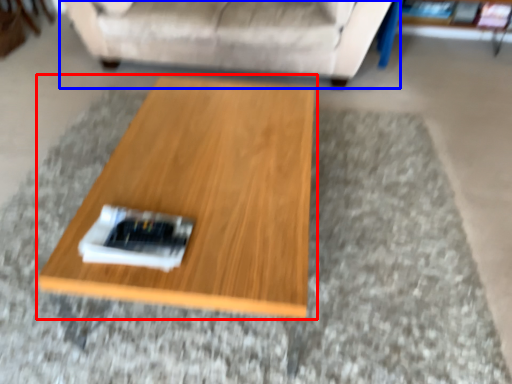
Question: Among these objects, which one is farthest to the camera, coffee table (highlighted by a red box) or studio couch (highlighted by a blue box)?

Choices:
 (A) coffee table
 (B) studio couch

Answer: (B)